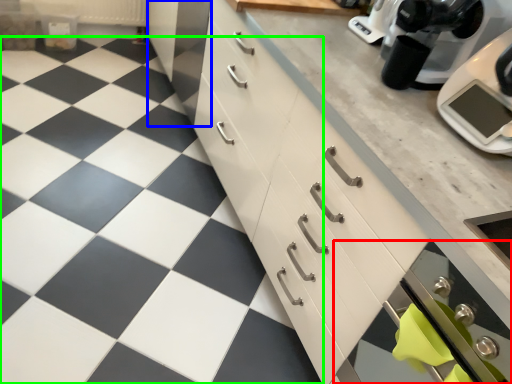
Question: Based on their relative distances, which object is farther from oven (highlighted by a red box)? Choose from cabinetry (highlighted by a blue box) and tile (highlighted by a green box).

Choices:
 (A) cabinetry
 (B) tile

Answer: (A)